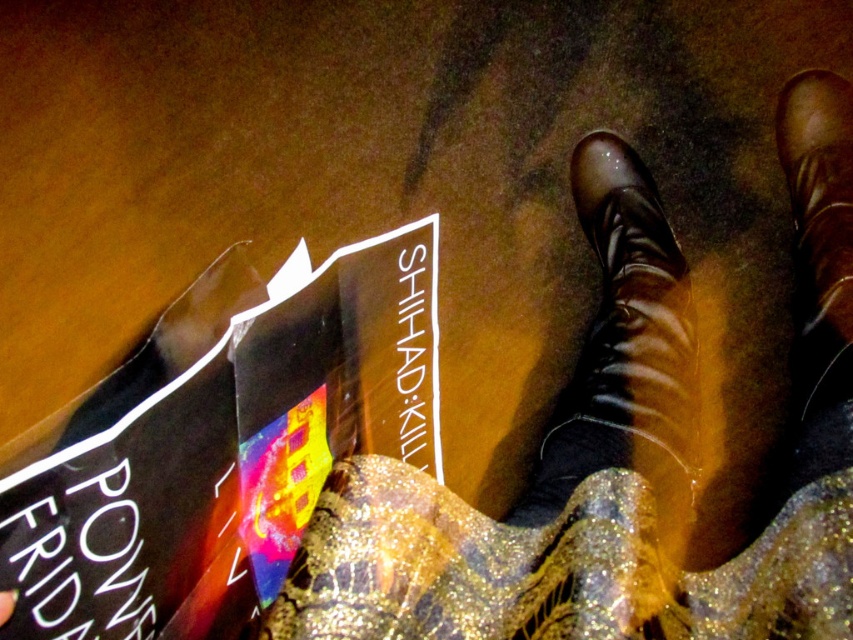
Question: Can you confirm if black matte book at lower left is positioned below shiny leather boot at center?

Choices:
 (A) no
 (B) yes

Answer: (B)

Question: Considering the real-world distances, which object is closest to the black matte book at lower left?

Choices:
 (A) shiny leather boot at center
 (B) brown leather boot at center
 (C) shiny brown boots at center

Answer: (C)

Question: Based on their relative distances, which object is nearer to the brown leather boot at center?

Choices:
 (A) black matte book at lower left
 (B) shiny leather boot at center
 (C) shiny brown boots at center

Answer: (C)

Question: Which point is closer to the camera?

Choices:
 (A) shiny brown boots at center
 (B) brown leather boot at center
 (C) black matte book at lower left
 (D) shiny leather boot at center

Answer: (A)

Question: Is black matte book at lower left to the right of brown leather boot at center from the viewer's perspective?

Choices:
 (A) yes
 (B) no

Answer: (B)

Question: Does black matte book at lower left appear on the left side of brown leather boot at center?

Choices:
 (A) yes
 (B) no

Answer: (A)